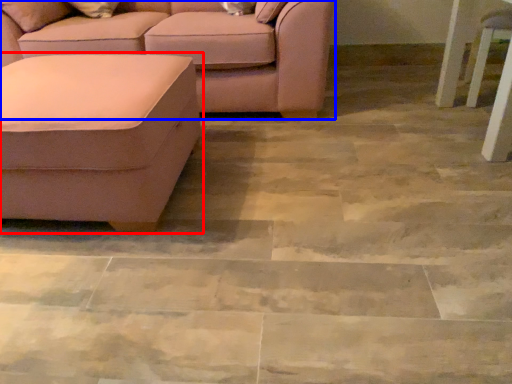
Question: Which point is closer to the camera, studio couch (highlighted by a red box) or studio couch (highlighted by a blue box)?

Choices:
 (A) studio couch
 (B) studio couch

Answer: (A)